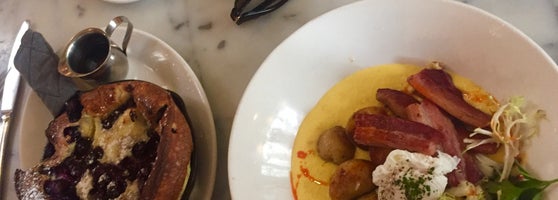
Locate an element on the screen. Image resolution: width=558 pixels, height=200 pixels. nasty looking cream table is located at coordinates (310, 15).